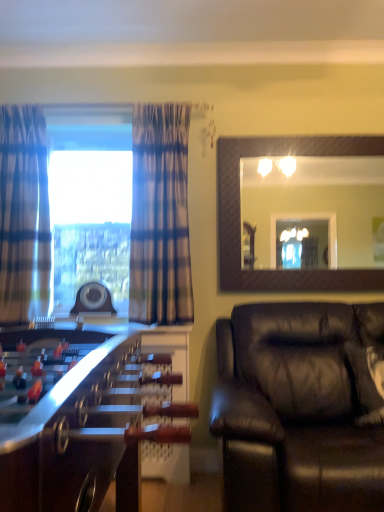
The width and height of the screenshot is (384, 512). Describe the element at coordinates (160, 216) in the screenshot. I see `plaid fabric curtain at left, the 1th curtain from the right` at that location.

In order to face matte brown mirror at upper right, should I rotate leftwards or rightwards?

You should rotate right by 14.677 degrees.

The image size is (384, 512). I want to click on black leather couch at lower right, so click(x=299, y=407).

You are a GUI agent. You are given a task and a screenshot of the screen. Output one action in this format:
    pyautogui.click(x=<x>, y=<y>)
    Task: Click on the wooden foosball table at left
    The height and width of the screenshot is (512, 384).
    Given the screenshot: What is the action you would take?
    pyautogui.click(x=78, y=421)

What do you see at coordinates (78, 421) in the screenshot? I see `wooden foosball table at left` at bounding box center [78, 421].

In order to click on plaid fabric curtain at left, which is the 2th curtain from left to right in this screenshot , I will do `click(160, 216)`.

Considering the sizes of objects plaid fabric curtain at left, which is the 2th curtain from left to right, and plaid fabric curtain at left, acting as the 1th curtain starting from the left, in the image provided, who is smaller, plaid fabric curtain at left, which is the 2th curtain from left to right, or plaid fabric curtain at left, acting as the 1th curtain starting from the left,?

plaid fabric curtain at left, acting as the 1th curtain starting from the left, is smaller.

Does plaid fabric curtain at left, the 1th curtain from the right, come behind plaid fabric curtain at left, arranged as the second curtain when viewed from the right?

Yes, plaid fabric curtain at left, the 1th curtain from the right, is further from the camera.

Considering the positions of point (155, 272) and point (30, 238), is point (155, 272) closer or farther from the camera than point (30, 238)?

Point (155, 272) is closer to the camera than point (30, 238).

Is black leather couch at lower right with plaid fabric curtain at left, arranged as the second curtain when viewed from the right?

No, black leather couch at lower right is not in contact with plaid fabric curtain at left, arranged as the second curtain when viewed from the right.

Considering the points (316, 335) and (30, 126), which point is behind, point (316, 335) or point (30, 126)?

The point (30, 126) is more distant.

Is black leather couch at lower right facing away from plaid fabric curtain at left, acting as the 1th curtain starting from the left?

That's not correct — black leather couch at lower right is not looking away from plaid fabric curtain at left, acting as the 1th curtain starting from the left.

Image resolution: width=384 pixels, height=512 pixels. Identify the location of studio couch in front of the plaid fabric curtain at left, arranged as the second curtain when viewed from the right. (299, 407).

From a real-world perspective, is matte brown mirror at upper right under black leather couch at lower right?

No.

Considering the relative positions of matte brown mirror at upper right and black leather couch at lower right in the image provided, is matte brown mirror at upper right in front of black leather couch at lower right?

No.

Is matte brown mirror at upper right positioned with its back to plaid fabric curtain at left, which is the 2th curtain from left to right?

No.

From the image's perspective, between matte brown mirror at upper right and plaid fabric curtain at left, which is the 2th curtain from left to right, which one is located above?

matte brown mirror at upper right, from the image's perspective.

Which object is more forward, matte brown mirror at upper right or plaid fabric curtain at left, which is the 2th curtain from left to right?

plaid fabric curtain at left, which is the 2th curtain from left to right.

Who is taller, matte brown mirror at upper right or plaid fabric curtain at left, the 1th curtain from the right?

Standing taller between the two is plaid fabric curtain at left, the 1th curtain from the right.

The width and height of the screenshot is (384, 512). What are the coordinates of `the 1st curtain above the black leather couch at lower right (from the image's perspective)` in the screenshot? It's located at (160, 216).

Can you confirm if black leather couch at lower right is wider than plaid fabric curtain at left, the 1th curtain from the right?

Indeed, black leather couch at lower right has a greater width compared to plaid fabric curtain at left, the 1th curtain from the right.

In the scene shown: From the image's perspective, relative to plaid fabric curtain at left, which is the 2th curtain from left to right, is black leather couch at lower right above or below?

Clearly, from the image's perspective, black leather couch at lower right is below plaid fabric curtain at left, which is the 2th curtain from left to right.

From the image's perspective, is plaid fabric curtain at left, which is the 2th curtain from left to right, above or below wooden foosball table at left?

From the image's perspective, plaid fabric curtain at left, which is the 2th curtain from left to right, appears above wooden foosball table at left.

In terms of size, does plaid fabric curtain at left, which is the 2th curtain from left to right, appear bigger or smaller than wooden foosball table at left?

Considering their sizes, plaid fabric curtain at left, which is the 2th curtain from left to right, takes up less space than wooden foosball table at left.

Looking at this image, which object is positioned more to the right, plaid fabric curtain at left, the 1th curtain from the right, or wooden foosball table at left?

plaid fabric curtain at left, the 1th curtain from the right, is more to the right.

Is plaid fabric curtain at left, the 1th curtain from the right, situated inside wooden foosball table at left or outside?

plaid fabric curtain at left, the 1th curtain from the right, is not enclosed by wooden foosball table at left.

From a real-world perspective, is plaid fabric curtain at left, which is the 2th curtain from left to right, physically located above or below matte brown mirror at upper right?

plaid fabric curtain at left, which is the 2th curtain from left to right, is below matte brown mirror at upper right.

Who is bigger, plaid fabric curtain at left, the 1th curtain from the right, or matte brown mirror at upper right?

Bigger between the two is plaid fabric curtain at left, the 1th curtain from the right.

Choose the correct answer: Is plaid fabric curtain at left, which is the 2th curtain from left to right, inside matte brown mirror at upper right or outside it?

plaid fabric curtain at left, which is the 2th curtain from left to right, is outside matte brown mirror at upper right.

Is the depth of plaid fabric curtain at left, which is the 2th curtain from left to right, greater than that of matte brown mirror at upper right?

No, it is in front of matte brown mirror at upper right.

The height and width of the screenshot is (512, 384). I want to click on curtain in front of the plaid fabric curtain at left, which is the 2th curtain from left to right, so click(x=24, y=216).

You are a GUI agent. You are given a task and a screenshot of the screen. Output one action in this format:
    pyautogui.click(x=<x>, y=<y>)
    Task: Click on the 2nd curtain located above the black leather couch at lower right (from a real-world perspective)
    Image resolution: width=384 pixels, height=512 pixels.
    Given the screenshot: What is the action you would take?
    pyautogui.click(x=24, y=216)

Based on their spatial positions, is black leather couch at lower right or wooden foosball table at left closer to matte brown mirror at upper right?

black leather couch at lower right is positioned closer to the anchor matte brown mirror at upper right.

When comparing their distances from plaid fabric curtain at left, arranged as the second curtain when viewed from the right, does matte brown mirror at upper right or plaid fabric curtain at left, the 1th curtain from the right, seem further?

matte brown mirror at upper right is positioned further to the anchor plaid fabric curtain at left, arranged as the second curtain when viewed from the right.

Which object lies nearer to the anchor point wooden foosball table at left, plaid fabric curtain at left, arranged as the second curtain when viewed from the right, or plaid fabric curtain at left, the 1th curtain from the right?

The object closer to wooden foosball table at left is plaid fabric curtain at left, the 1th curtain from the right.

Looking at the image, which one is located closer to wooden foosball table at left, matte brown mirror at upper right or plaid fabric curtain at left, acting as the 1th curtain starting from the left?

The object closer to wooden foosball table at left is plaid fabric curtain at left, acting as the 1th curtain starting from the left.

Looking at the image, which one is located closer to plaid fabric curtain at left, the 1th curtain from the right, plaid fabric curtain at left, arranged as the second curtain when viewed from the right, or black leather couch at lower right?

plaid fabric curtain at left, arranged as the second curtain when viewed from the right.

When comparing their distances from black leather couch at lower right, does plaid fabric curtain at left, the 1th curtain from the right, or plaid fabric curtain at left, arranged as the second curtain when viewed from the right, seem further?

plaid fabric curtain at left, arranged as the second curtain when viewed from the right, is positioned further to the anchor black leather couch at lower right.

When comparing their distances from matte brown mirror at upper right, does black leather couch at lower right or plaid fabric curtain at left, which is the 2th curtain from left to right, seem further?

black leather couch at lower right is further to matte brown mirror at upper right.

Which object lies further to the anchor point plaid fabric curtain at left, the 1th curtain from the right, matte brown mirror at upper right or wooden foosball table at left?

wooden foosball table at left is positioned further to the anchor plaid fabric curtain at left, the 1th curtain from the right.

Identify the location of curtain between wooden foosball table at left and plaid fabric curtain at left, the 1th curtain from the right, along the z-axis. (24, 216).

The height and width of the screenshot is (512, 384). What are the coordinates of `studio couch between wooden foosball table at left and plaid fabric curtain at left, which is the 2th curtain from left to right, in the front-back direction` in the screenshot? It's located at (299, 407).

The height and width of the screenshot is (512, 384). I want to click on studio couch positioned between wooden foosball table at left and matte brown mirror at upper right from near to far, so click(x=299, y=407).

Find the location of a particular element. curtain between plaid fabric curtain at left, acting as the 1th curtain starting from the left, and black leather couch at lower right, in the horizontal direction is located at coordinates (160, 216).